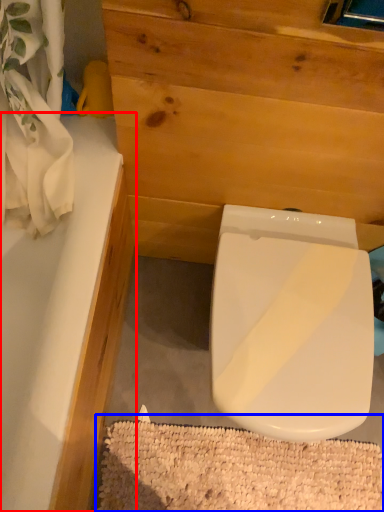
Question: Which object is closer to the camera taking this photo, bathtub (highlighted by a red box) or bath mat (highlighted by a blue box)?

Choices:
 (A) bathtub
 (B) bath mat

Answer: (A)